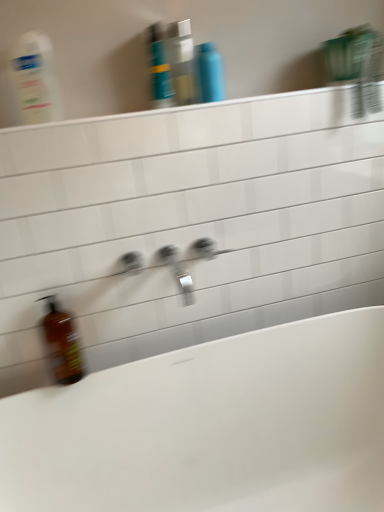
Question: Which direction should I rotate to look at blue glossy bottle at upper center, marked as the 2th mouthwash in a left-to-right arrangement?

Choices:
 (A) left
 (B) right

Answer: (B)

Question: Would you say translucent plastic mouthwash at upper center, acting as the second mouthwash starting from the right, is a long distance from blue glossy bottle at upper center, marked as the 2th mouthwash in a left-to-right arrangement?

Choices:
 (A) yes
 (B) no

Answer: (B)

Question: Is translucent plastic mouthwash at upper center, the first mouthwash viewed from the left, completely or partially outside of blue glossy bottle at upper center, marked as the 2th mouthwash in a left-to-right arrangement?

Choices:
 (A) yes
 (B) no

Answer: (A)

Question: From a real-world perspective, is translucent plastic mouthwash at upper center, acting as the second mouthwash starting from the right, over blue glossy bottle at upper center, which is the first mouthwash from right to left?

Choices:
 (A) yes
 (B) no

Answer: (A)

Question: Is translucent plastic mouthwash at upper center, acting as the second mouthwash starting from the right, placed right next to blue glossy bottle at upper center, which is the first mouthwash from right to left?

Choices:
 (A) no
 (B) yes

Answer: (B)

Question: Is blue glossy bottle at upper center, marked as the 2th mouthwash in a left-to-right arrangement, a part of translucent plastic mouthwash at upper center, acting as the second mouthwash starting from the right?

Choices:
 (A) yes
 (B) no

Answer: (B)

Question: Is translucent plastic mouthwash at upper center, acting as the second mouthwash starting from the right, behind blue glossy bottle at upper center, which is the first mouthwash from right to left?

Choices:
 (A) no
 (B) yes

Answer: (A)

Question: From a real-world perspective, does blue glossy shampoo bottle at upper center sit lower than translucent plastic bottle at upper left?

Choices:
 (A) yes
 (B) no

Answer: (B)

Question: Is blue glossy shampoo bottle at upper center shorter than translucent plastic bottle at upper left?

Choices:
 (A) yes
 (B) no

Answer: (A)

Question: Considering the relative positions of blue glossy shampoo bottle at upper center and translucent plastic bottle at upper left in the image provided, is blue glossy shampoo bottle at upper center to the left of translucent plastic bottle at upper left from the viewer's perspective?

Choices:
 (A) no
 (B) yes

Answer: (A)

Question: Does blue glossy shampoo bottle at upper center contain translucent plastic bottle at upper left?

Choices:
 (A) no
 (B) yes

Answer: (A)

Question: Is blue glossy shampoo bottle at upper center wider than translucent plastic bottle at upper left?

Choices:
 (A) no
 (B) yes

Answer: (B)

Question: Is the position of blue glossy shampoo bottle at upper center less distant than that of translucent plastic bottle at upper left?

Choices:
 (A) no
 (B) yes

Answer: (A)

Question: Does translucent plastic mouthwash at upper center, acting as the second mouthwash starting from the right, appear on the right side of translucent plastic bottle at upper left?

Choices:
 (A) yes
 (B) no

Answer: (A)